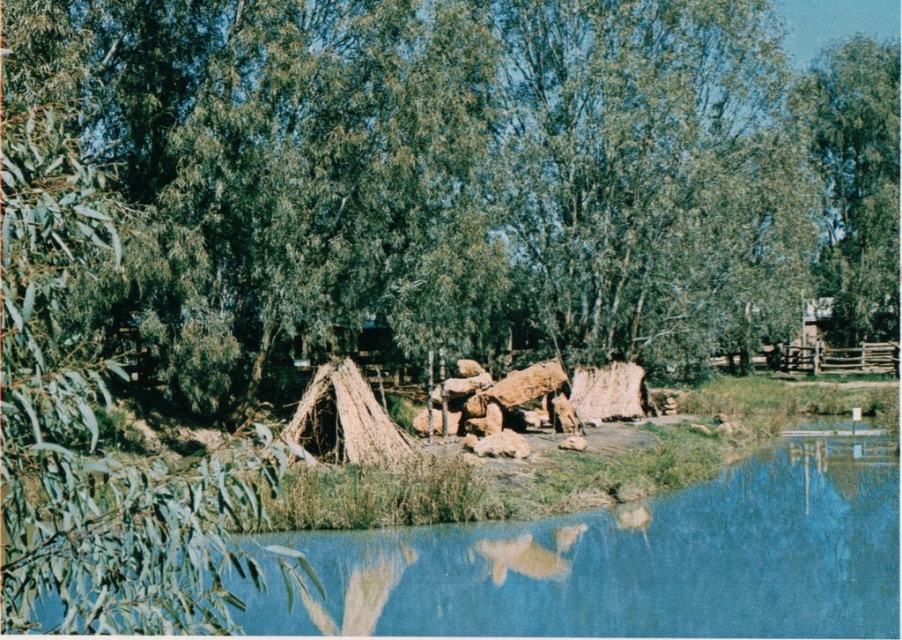
You are standing in the serene outdoor scene and want to take a photo of both the blue water at lower center and the green leafy tree at upper right. Which object should you focus on first to ensure both are in clear view?

You should focus on the blue water at lower center first because it is closer to the viewer than the green leafy tree at upper right, so adjusting focus starting from the closer object will help both be in clear view.

You are standing in the serene outdoor scene and want to move from the point closer to you to the point further away. Which path would you take between the two points, point [531,596] and point [827,237]?

You should take the path leading from point [531,596] to point [827,237] because point [531,596] is closer to the viewer and you need to move towards the point [827,237] which is further away.